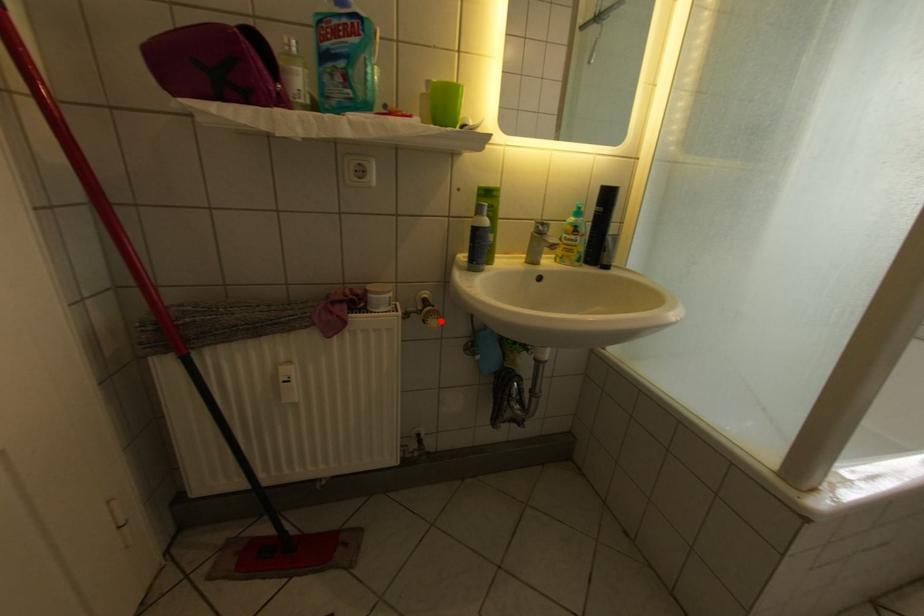
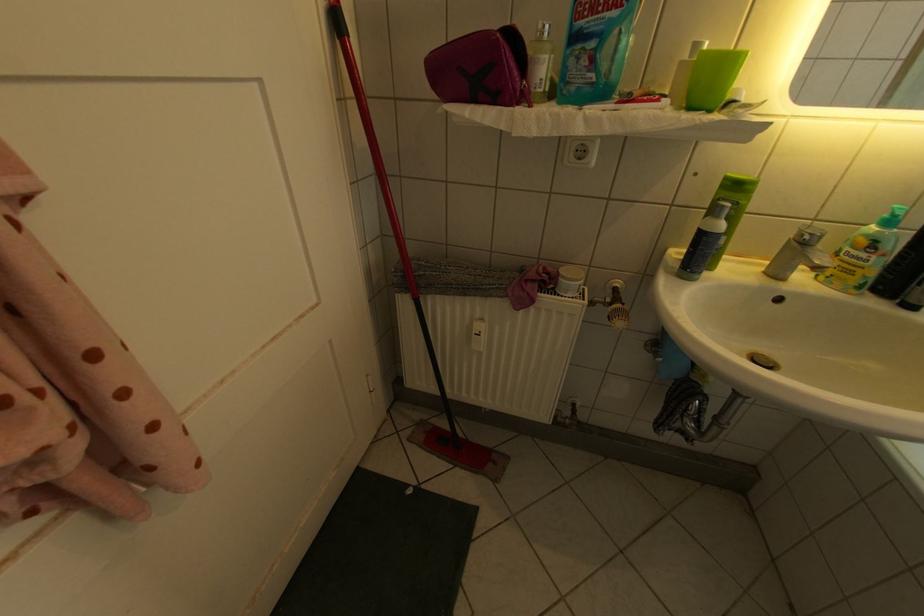
In the second image, find the point that corresponds to the highlighted location in the first image.

(626, 320)